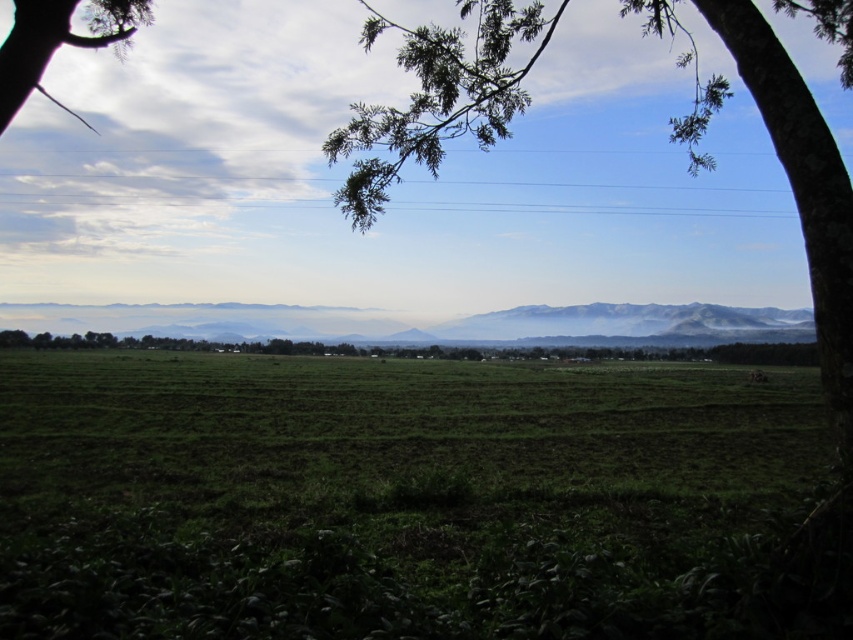
Measure the distance from green leafy tree at center to green leafy tree at upper left.

green leafy tree at center and green leafy tree at upper left are 22.61 meters apart.

Looking at this image, can you confirm if green leafy tree at center is bigger than green leafy tree at upper left?

Yes, green leafy tree at center is bigger than green leafy tree at upper left.

Which is behind, point (343, 138) or point (41, 54)?

Positioned behind is point (343, 138).

Where is `green leafy tree at center`? The height and width of the screenshot is (640, 853). green leafy tree at center is located at coordinates (438, 97).

Is green matte grass at center taller than green leafy tree at upper left?

Incorrect, green matte grass at center's height is not larger of green leafy tree at upper left's.

From the picture: Can you confirm if green matte grass at center is positioned to the right of green leafy tree at upper left?

Indeed, green matte grass at center is positioned on the right side of green leafy tree at upper left.

This screenshot has height=640, width=853. In order to click on green matte grass at center in this screenshot , I will do `click(415, 499)`.

Identify the location of green matte grass at center. The height and width of the screenshot is (640, 853). (415, 499).

Does green matte grass at center appear over green leafy tree at center?

No, green matte grass at center is not above green leafy tree at center.

Between green matte grass at center and green leafy tree at center, which one is positioned lower?

Positioned lower is green matte grass at center.

Find the location of a particular element. The image size is (853, 640). green matte grass at center is located at coordinates (415, 499).